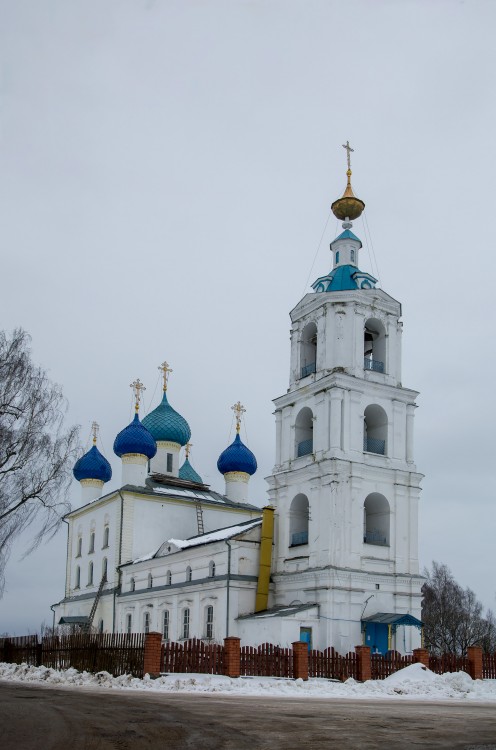
At what (x,y) coordinates should I click in order to perform the action: click on window. Please return your answer as a coordinate pair (x, y). This screenshot has width=496, height=750. Looking at the image, I should click on (147, 630).